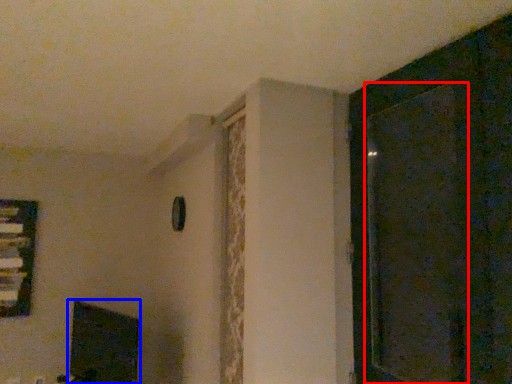
Question: Among these objects, which one is farthest to the camera, screen door (highlighted by a red box) or fireplace (highlighted by a blue box)?

Choices:
 (A) screen door
 (B) fireplace

Answer: (B)